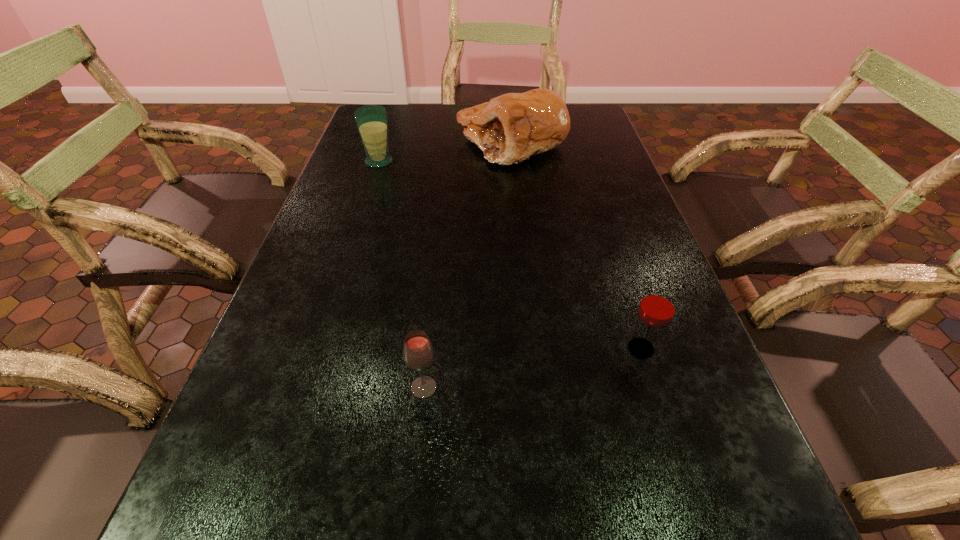
The image size is (960, 540). I want to click on vacant space located on the right of the farthest glass drink container, so pos(419,161).

The width and height of the screenshot is (960, 540). Identify the location of vacant area situated on the left of the second nearest object. point(426,349).

The width and height of the screenshot is (960, 540). Find the location of `vacant space located on the left of the second glass drink container from left to right`. vacant space located on the left of the second glass drink container from left to right is located at coordinates (291, 388).

Where is `object that is at the far edge`? object that is at the far edge is located at coordinates (510, 128).

This screenshot has height=540, width=960. In order to click on object that is at the left edge in this screenshot , I will do `click(372, 120)`.

In order to click on bread that is positioned at the right edge in this screenshot , I will do `click(510, 128)`.

Identify the location of glass present at the right edge. Image resolution: width=960 pixels, height=540 pixels. (657, 307).

I want to click on object at the far right corner, so click(x=510, y=128).

Identify the location of vacant point at the far edge. The image size is (960, 540). (430, 117).

You are a GUI agent. You are given a task and a screenshot of the screen. Output one action in this format:
    pyautogui.click(x=<x>, y=<y>)
    Task: Click on the vacant region at the left edge
    Image resolution: width=960 pixels, height=540 pixels.
    Given the screenshot: What is the action you would take?
    (x=208, y=539)